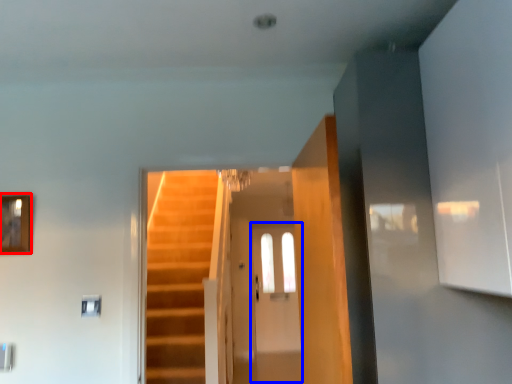
Question: Which object is further to the camera taking this photo, picture frame (highlighted by a red box) or glass door (highlighted by a blue box)?

Choices:
 (A) picture frame
 (B) glass door

Answer: (B)